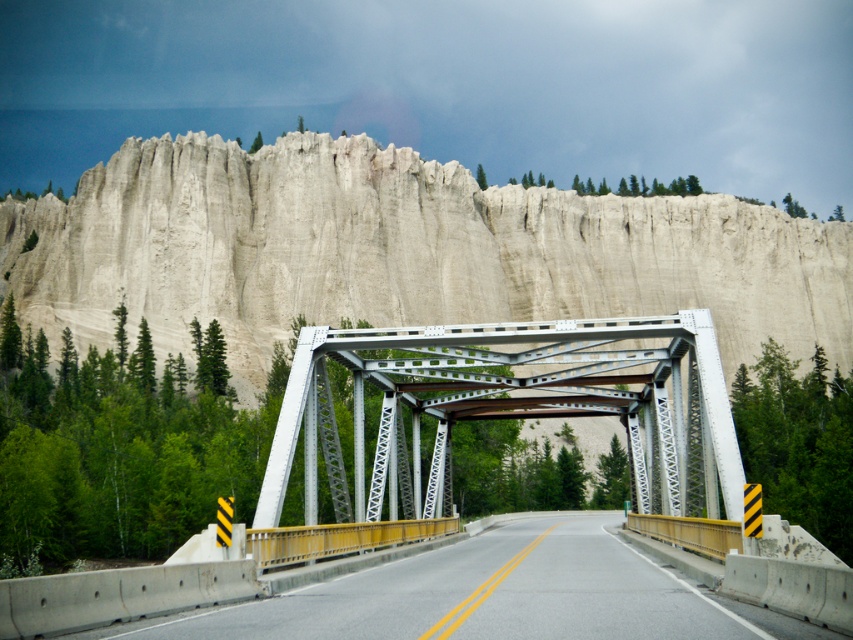
What do you see at coordinates (399, 252) in the screenshot? Image resolution: width=853 pixels, height=640 pixels. I see `smooth sandstone cliff at upper center` at bounding box center [399, 252].

Does point (346, 140) come closer to viewer compared to point (608, 634)?

No, (346, 140) is behind (608, 634).

Identify the location of smooth sandstone cliff at upper center. The height and width of the screenshot is (640, 853). [x=399, y=252].

Which is in front, point (664, 248) or point (437, 406)?

Positioned in front is point (437, 406).

Consider the image. Who is taller, smooth sandstone cliff at upper center or white metallic bridge at center?

With more height is smooth sandstone cliff at upper center.

Image resolution: width=853 pixels, height=640 pixels. Identify the location of smooth sandstone cliff at upper center. (399, 252).

Locate an element on the screen. This screenshot has height=640, width=853. smooth sandstone cliff at upper center is located at coordinates (399, 252).

Which of these two, white metallic bridge at center or yellow painted concrete highway at center, stands taller?

With more height is white metallic bridge at center.

Between point (634, 444) and point (271, 598), which one is positioned in front?

Point (271, 598) is in front.

At what (x,y) coordinates should I click in order to perform the action: click on white metallic bridge at center. Please return your answer as a coordinate pair (x, y). The height and width of the screenshot is (640, 853). Looking at the image, I should click on (508, 403).